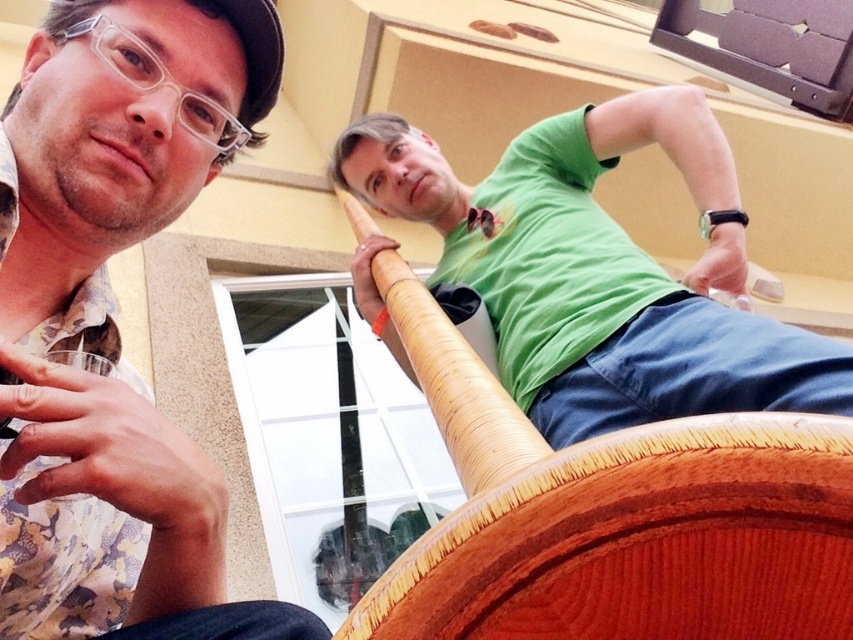
Can you confirm if matte floral shirt at left is wider than green matte t-shirt at upper center?

No, matte floral shirt at left is not wider than green matte t-shirt at upper center.

Between matte floral shirt at left and green matte t-shirt at upper center, which one has more height?

green matte t-shirt at upper center is taller.

The height and width of the screenshot is (640, 853). Find the location of `matte floral shirt at left`. matte floral shirt at left is located at coordinates (113, 320).

Identify the location of matte floral shirt at left. (113, 320).

Who is positioned more to the left, wooden chair at upper center or green matte t-shirt at upper center?

Positioned to the left is wooden chair at upper center.

How much distance is there between wooden chair at upper center and green matte t-shirt at upper center?

They are 39.08 centimeters apart.

This screenshot has height=640, width=853. Describe the element at coordinates (613, 516) in the screenshot. I see `wooden chair at upper center` at that location.

In order to click on wooden chair at upper center in this screenshot , I will do `click(613, 516)`.

Is the position of matte floral shirt at left more distant than that of wooden chair at upper center?

Yes, matte floral shirt at left is further from the viewer.

Does matte floral shirt at left have a lesser width compared to wooden chair at upper center?

No, matte floral shirt at left is not thinner than wooden chair at upper center.

Between point (57, 547) and point (758, 436), which one is positioned behind?

The point (57, 547) is behind.

Locate an element on the screen. matte floral shirt at left is located at coordinates (113, 320).